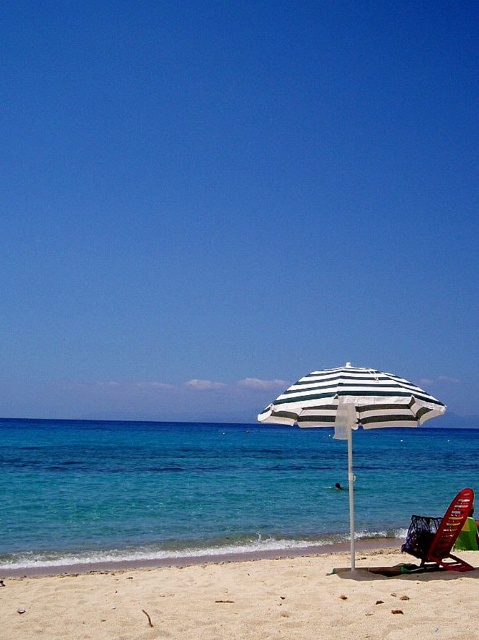
Between white sand at lower center and white striped umbrella at center, which one is positioned lower?

white striped umbrella at center is lower down.

Measure the distance between point (161, 602) and camera.

The distance of point (161, 602) from camera is 21.50 feet.

This screenshot has height=640, width=479. I want to click on white sand at lower center, so click(239, 600).

Who is higher up, blue water at center or white sand at lower center?

white sand at lower center is higher up.

Is blue water at center wider than white sand at lower center?

Yes.

This screenshot has width=479, height=640. What do you see at coordinates (163, 490) in the screenshot?
I see `blue water at center` at bounding box center [163, 490].

Locate an element on the screen. This screenshot has width=479, height=640. blue water at center is located at coordinates (163, 490).

Is point (344, 435) closer to viewer compared to point (456, 509)?

Yes, it is in front of point (456, 509).

Who is more forward, (x=273, y=403) or (x=462, y=528)?

Point (x=273, y=403)

Is point (371, 400) closer to viewer compared to point (467, 506)?

Yes.

The image size is (479, 640). What are the coordinates of `white striped umbrella at center` in the screenshot? It's located at (352, 408).